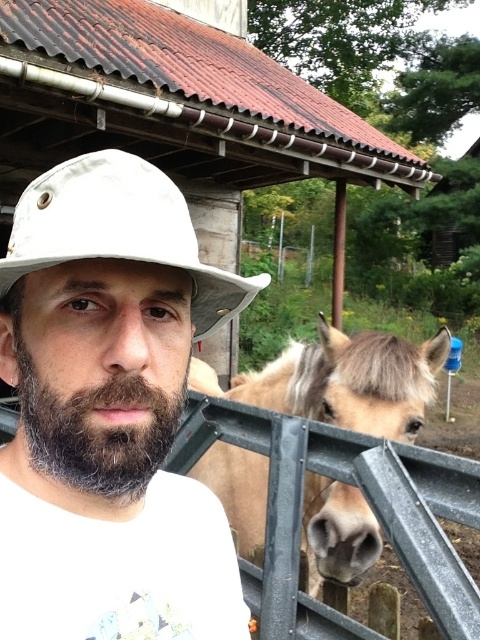
Question: Is white matte hat at center smaller than light brown fur at right?

Choices:
 (A) yes
 (B) no

Answer: (A)

Question: Which point is farther to the camera?

Choices:
 (A) white matte hat at center
 (B) gray matte beard at center
 (C) light brown fur at right

Answer: (C)

Question: Is the position of light brown fur at right less distant than that of gray matte beard at center?

Choices:
 (A) yes
 (B) no

Answer: (B)

Question: Which point appears closest to the camera in this image?

Choices:
 (A) (99, 241)
 (B) (188, 340)

Answer: (A)

Question: Which point is closer to the camera taking this photo?

Choices:
 (A) (299, 394)
 (B) (1, 468)

Answer: (B)

Question: Where is light brown fur at right located in relation to white matte cowboy hat at center in the image?

Choices:
 (A) left
 (B) right

Answer: (B)